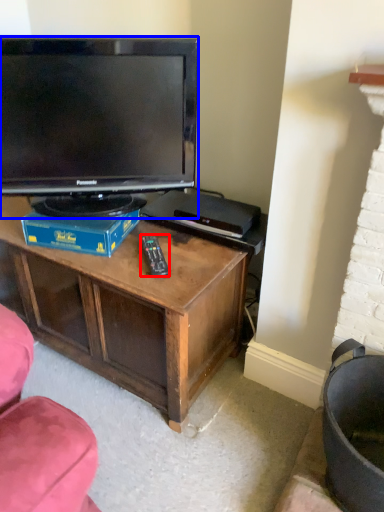
Question: Which point is further to the camera, remote (highlighted by a red box) or television (highlighted by a blue box)?

Choices:
 (A) remote
 (B) television

Answer: (A)